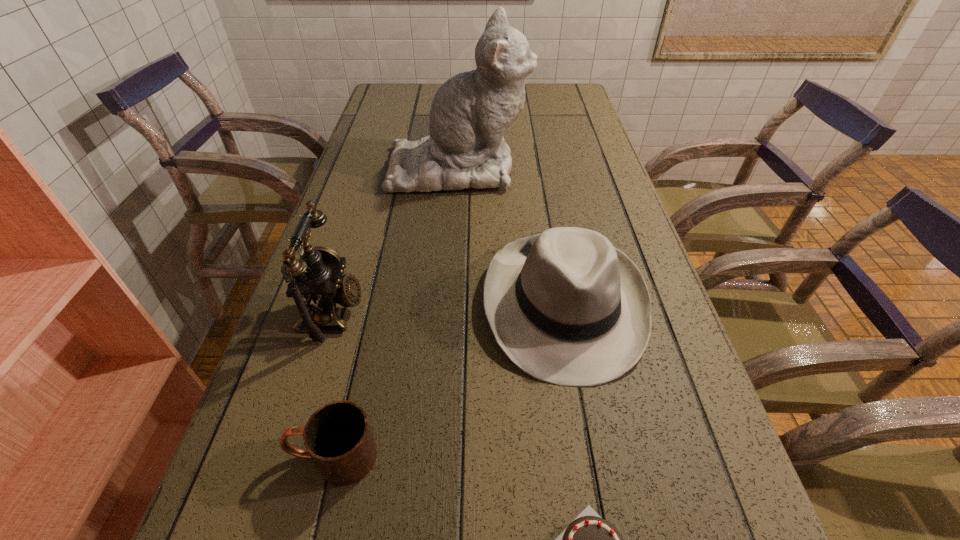
Where is `cat`? This screenshot has height=540, width=960. cat is located at coordinates (469, 113).

Find the location of `the tallest object`. the tallest object is located at coordinates (469, 113).

You are a GUI agent. You are given a task and a screenshot of the screen. Output one action in this format:
    pyautogui.click(x=<x>, y=<y>)
    Task: Click on the fourth shortest object
    This screenshot has height=540, width=960.
    Given the screenshot: What is the action you would take?
    pyautogui.click(x=316, y=282)

This screenshot has width=960, height=540. I want to click on fedora, so click(566, 307).

Identify the location of the second shortest object. [x=338, y=438].

You are a GUI agent. You are given a task and a screenshot of the screen. Output one action in this format:
    pyautogui.click(x=<x>, y=<y>)
    Task: Click on the second nearest object
    The image size is (960, 540).
    Given the screenshot: What is the action you would take?
    pyautogui.click(x=338, y=438)

At what (x,y) coordinates should I click in order to perform the action: click on vacant region located 0.060m on the front-facing side of the cat. Please return your answer as a coordinate pair (x, y). Looking at the image, I should click on click(x=548, y=167).

The height and width of the screenshot is (540, 960). Find the location of `blank area located on the rotary dial of the second tallest object`. blank area located on the rotary dial of the second tallest object is located at coordinates (456, 312).

Find the location of `free space located 0.070m on the front-facing side of the fedora`. free space located 0.070m on the front-facing side of the fedora is located at coordinates (586, 426).

The width and height of the screenshot is (960, 540). Find the location of `cat present at the left edge`. cat present at the left edge is located at coordinates (469, 113).